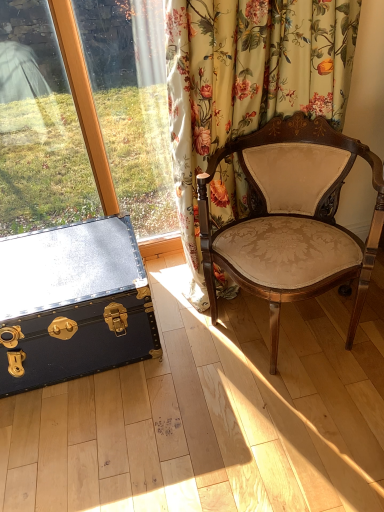
The image size is (384, 512). I want to click on free space in front of black leather trunk at lower left, so click(x=104, y=440).